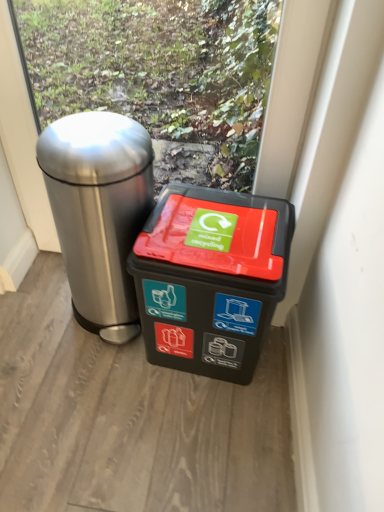
Where is `vacant space in front of black plastic recycling bin at center, the 2th waste container viewed from the left`? vacant space in front of black plastic recycling bin at center, the 2th waste container viewed from the left is located at coordinates (193, 432).